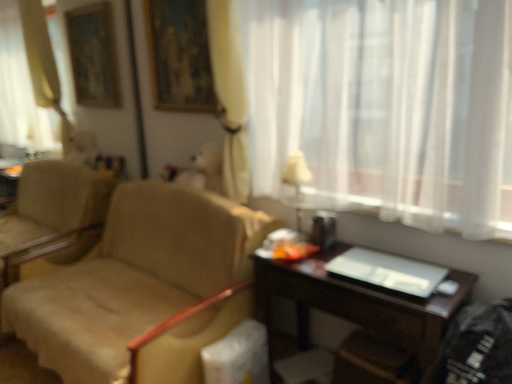
Where is `vacant space situated above white plastic laptop at right (from a real-world perspective)`? The image size is (512, 384). vacant space situated above white plastic laptop at right (from a real-world perspective) is located at coordinates (387, 270).